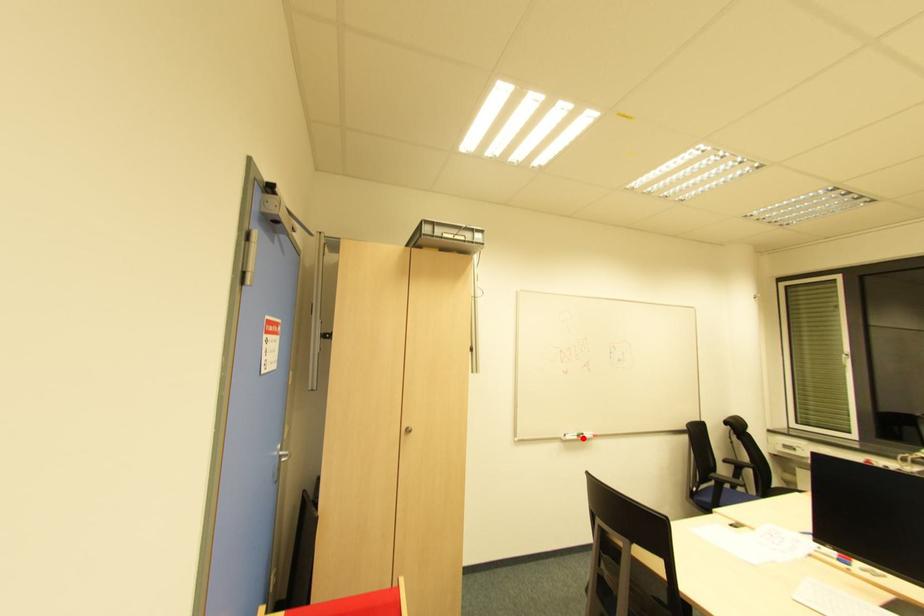
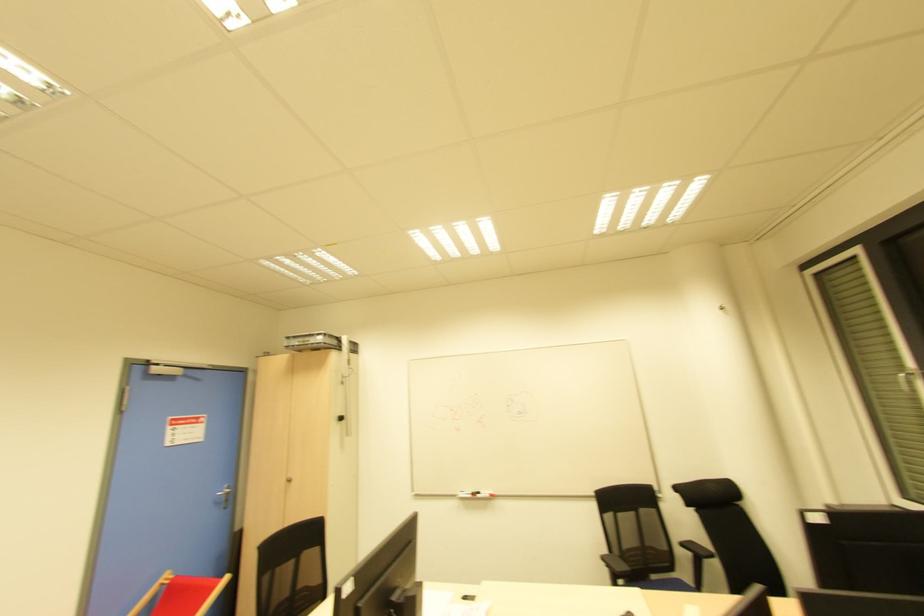
Locate, in the second image, the point that corresponds to the highlighted location in the first image.

(478, 496)